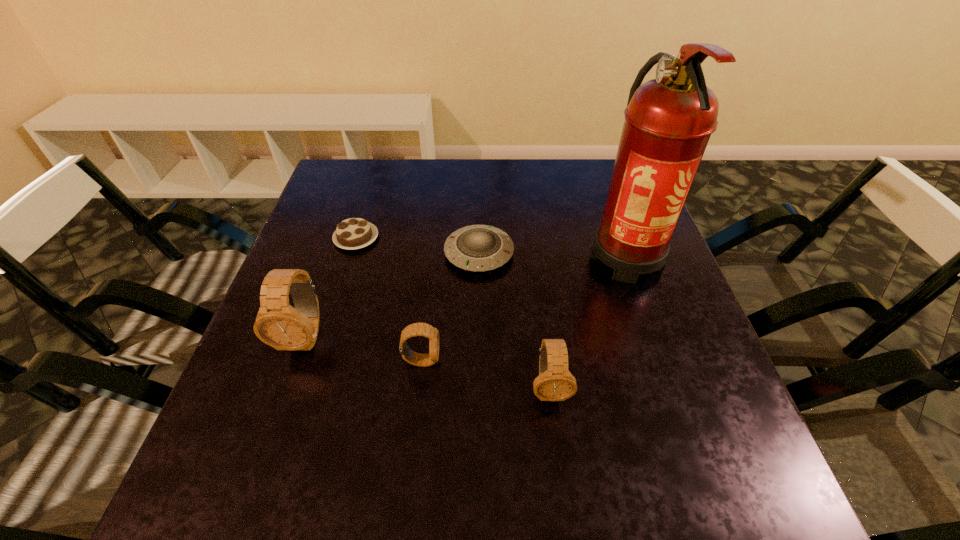
In the current image, all watchs are evenly spaced. To maintain this equal spacing, where should an additional watch be placed on the right? Please point out a free spot. Please provide its 2D coordinates. Your answer should be formatted as a tuple, i.e. [(x, y)], where the tuple contains the x and y coordinates of a point satisfying the conditions above.

[(689, 417)]